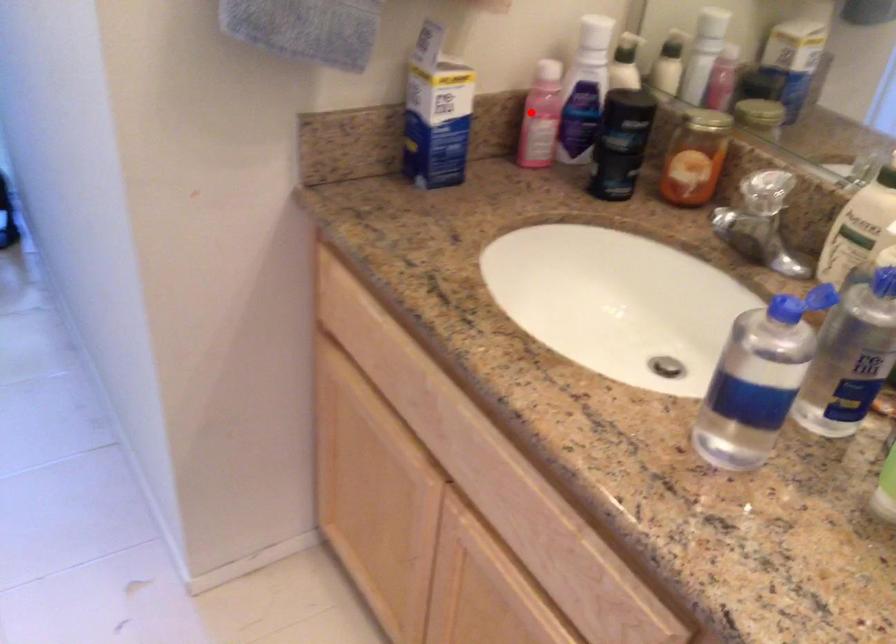
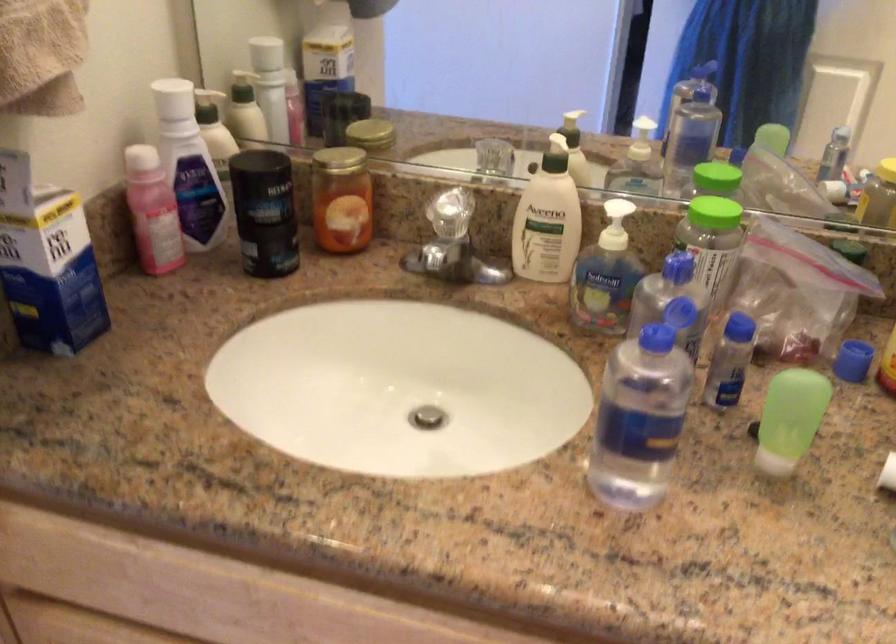
The point at the highlighted location is marked in the first image. Where is the corresponding point in the second image?

(152, 211)